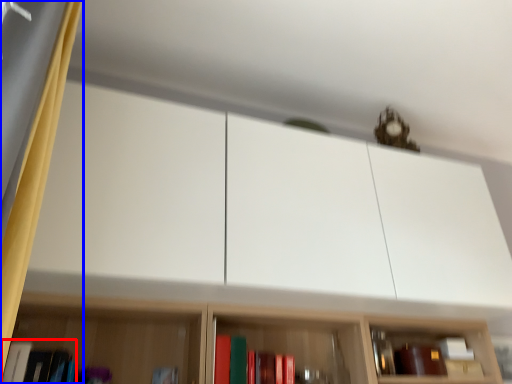
Question: Which object appears farthest to the camera in this image, book (highlighted by a red box) or curtain (highlighted by a blue box)?

Choices:
 (A) book
 (B) curtain

Answer: (A)